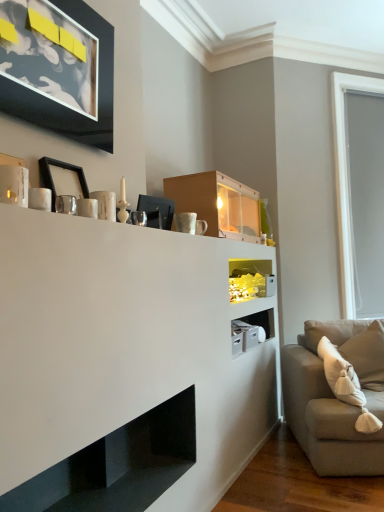
Identify the location of vacant area situated to the left side of light gray fabric couch at right. (275, 477).